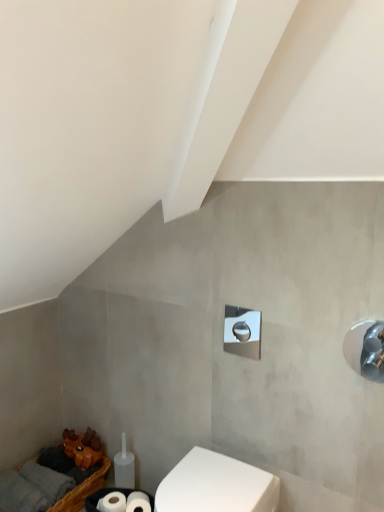
Question: Is polished chrome shower at center, marked as the second shower in a front-to-back arrangement, to the right of polished chrome shower at right, the second shower in the back-to-front sequence, from the viewer's perspective?

Choices:
 (A) no
 (B) yes

Answer: (A)

Question: Does polished chrome shower at center, which ranks as the 1th shower in left-to-right order, have a larger size compared to polished chrome shower at right, arranged as the 2th shower when viewed from the left?

Choices:
 (A) no
 (B) yes

Answer: (B)

Question: Would you say polished chrome shower at right, the second shower in the back-to-front sequence, is part of polished chrome shower at center, which is the 2th shower in right-to-left order,'s contents?

Choices:
 (A) no
 (B) yes

Answer: (A)

Question: Is polished chrome shower at center, marked as the second shower in a front-to-back arrangement, closer to the viewer compared to polished chrome shower at right, which ranks as the first shower in front-to-back order?

Choices:
 (A) yes
 (B) no

Answer: (B)

Question: Would you consider polished chrome shower at center, which is the 1th shower in back-to-front order, to be distant from polished chrome shower at right, which is counted as the first shower, starting from the right?

Choices:
 (A) no
 (B) yes

Answer: (A)

Question: Is polished chrome shower at center, marked as the second shower in a front-to-back arrangement, wider than polished chrome shower at right, which ranks as the first shower in front-to-back order?

Choices:
 (A) no
 (B) yes

Answer: (B)

Question: Is polished chrome shower at right, which ranks as the first shower in front-to-back order, further to the viewer compared to polished chrome shower at center, which is the 1th shower in back-to-front order?

Choices:
 (A) yes
 (B) no

Answer: (B)

Question: From the image's perspective, is polished chrome shower at right, the second shower in the back-to-front sequence, located above polished chrome shower at center, which is the 1th shower in back-to-front order?

Choices:
 (A) yes
 (B) no

Answer: (B)

Question: From the image's perspective, is polished chrome shower at right, the second shower in the back-to-front sequence, under polished chrome shower at center, which is the 1th shower in back-to-front order?

Choices:
 (A) yes
 (B) no

Answer: (A)

Question: Can you confirm if polished chrome shower at right, the second shower in the back-to-front sequence, is thinner than polished chrome shower at center, marked as the second shower in a front-to-back arrangement?

Choices:
 (A) no
 (B) yes

Answer: (B)

Question: Does polished chrome shower at right, which is counted as the first shower, starting from the right, appear on the right side of polished chrome shower at center, which is the 1th shower in back-to-front order?

Choices:
 (A) no
 (B) yes

Answer: (B)

Question: Does polished chrome shower at right, which ranks as the first shower in front-to-back order, have a lesser height compared to polished chrome shower at center, marked as the second shower in a front-to-back arrangement?

Choices:
 (A) no
 (B) yes

Answer: (A)

Question: From the image's perspective, is brown woven basket at lower left above white glossy toilet at lower center?

Choices:
 (A) yes
 (B) no

Answer: (B)